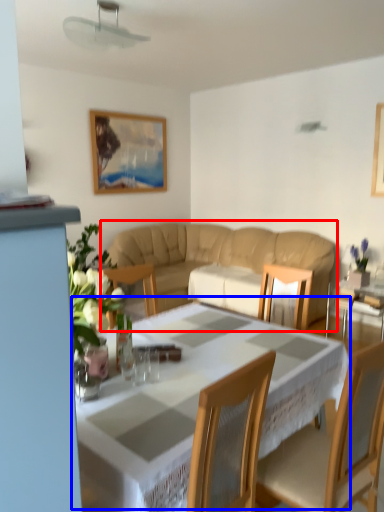
Question: Which object appears closest to the camera in this image, studio couch (highlighted by a red box) or table (highlighted by a blue box)?

Choices:
 (A) studio couch
 (B) table

Answer: (B)